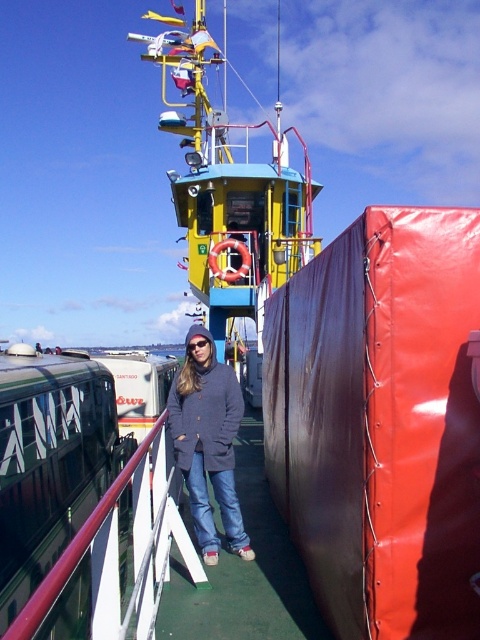
Question: Which object is closer to the camera taking this photo?

Choices:
 (A) matte blue jacket at center
 (B) metallic red railing at center

Answer: (B)

Question: Where is matte blue jacket at center located in relation to metallic red railing at center in the image?

Choices:
 (A) right
 (B) left

Answer: (A)

Question: Among these objects, which one is farthest from the camera?

Choices:
 (A) metallic red railing at center
 (B) matte blue jacket at center

Answer: (B)

Question: Is matte blue jacket at center above metallic red railing at center?

Choices:
 (A) yes
 (B) no

Answer: (B)

Question: Does matte blue jacket at center have a smaller size compared to metallic red railing at center?

Choices:
 (A) yes
 (B) no

Answer: (B)